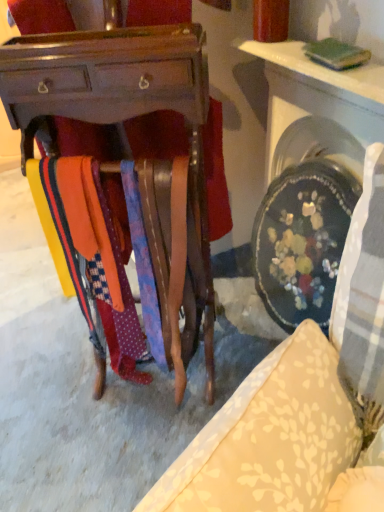
Locate an element on the screen. empty space that is ontop of white glossy table at upper right (from a real-world perspective) is located at coordinates (302, 52).